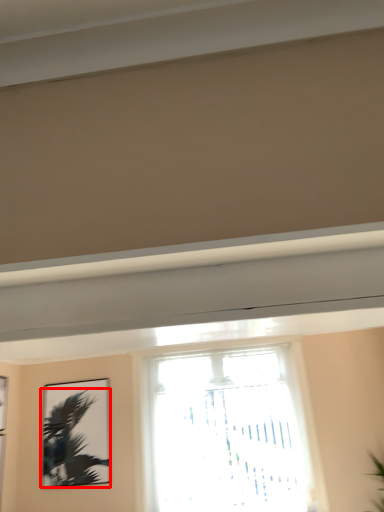
Question: Where is palm tree (annotated by the red box) located in relation to window in the image?

Choices:
 (A) left
 (B) right

Answer: (A)